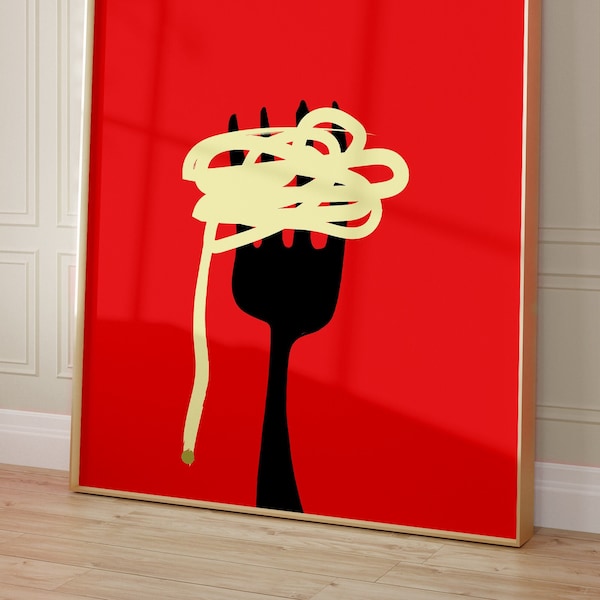
The width and height of the screenshot is (600, 600). I want to click on baseboard, so click(562, 493), click(39, 448).